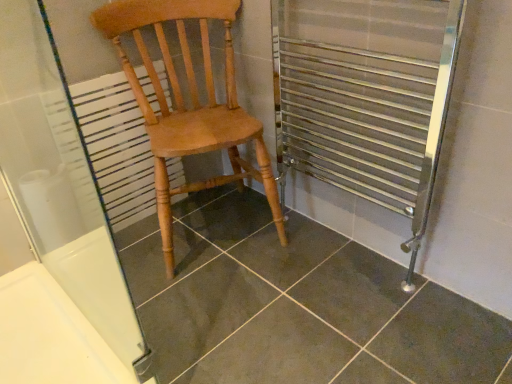
At what (x,y) coordinates should I click in order to perform the action: click on free point behind transparent glass screen door at upper left. Please return your answer as a coordinate pair (x, y). This screenshot has height=384, width=512. Looking at the image, I should click on (148, 271).